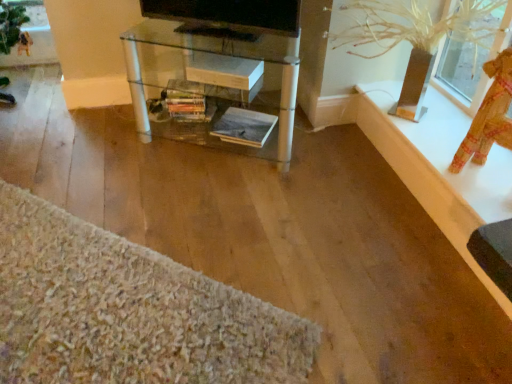
Image resolution: width=512 pixels, height=384 pixels. I want to click on blank space situated above white glossy ledge at upper right (from a real-world perspective), so click(x=433, y=162).